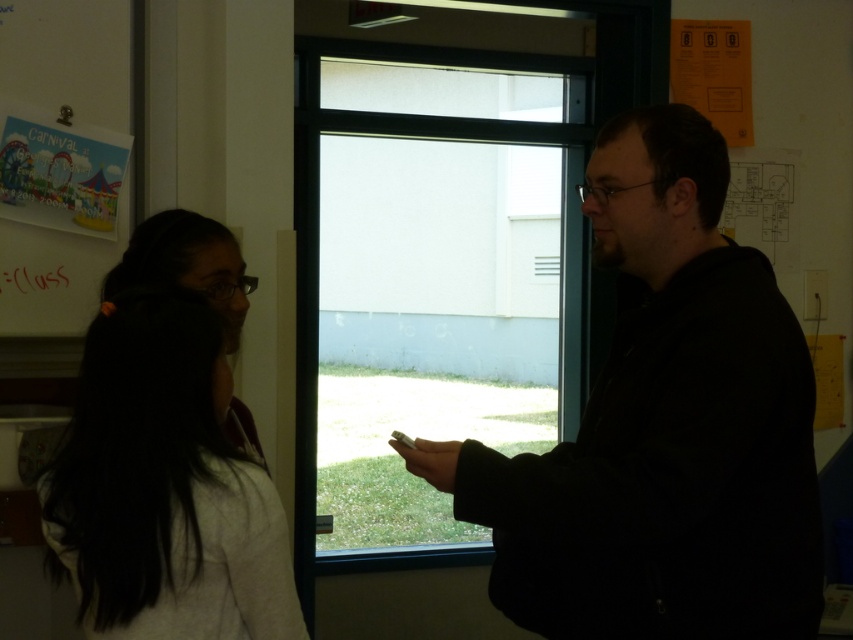
Question: Which of the following is the farthest from the observer?

Choices:
 (A) (142, 560)
 (B) (457, 403)
 (C) (27, 8)
 (D) (657, 630)

Answer: (B)

Question: Which of the following is the closest to the observer?

Choices:
 (A) (73, 65)
 (B) (524, 506)
 (C) (154, 572)

Answer: (C)

Question: Does transparent glass window at center have a larger size compared to white matte hair at left?

Choices:
 (A) yes
 (B) no

Answer: (A)

Question: Is white matte hair at left to the left of matte paper poster at left from the viewer's perspective?

Choices:
 (A) yes
 (B) no

Answer: (B)

Question: Among these objects, which one is farthest from the camera?

Choices:
 (A) matte paper poster at left
 (B) white matte hair at left
 (C) transparent glass window at center

Answer: (C)

Question: Is transparent glass window at center below matte paper poster at left?

Choices:
 (A) yes
 (B) no

Answer: (A)